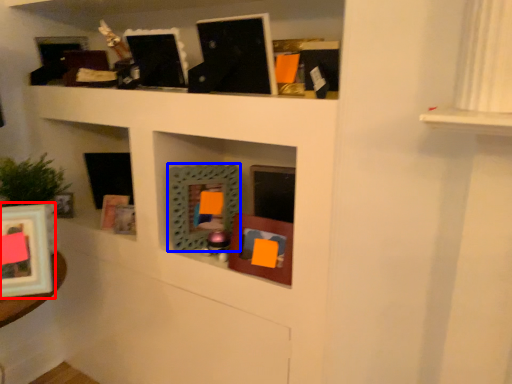
Question: Which object is further to the camera taking this photo, picture frame (highlighted by a red box) or picture frame (highlighted by a blue box)?

Choices:
 (A) picture frame
 (B) picture frame

Answer: (B)